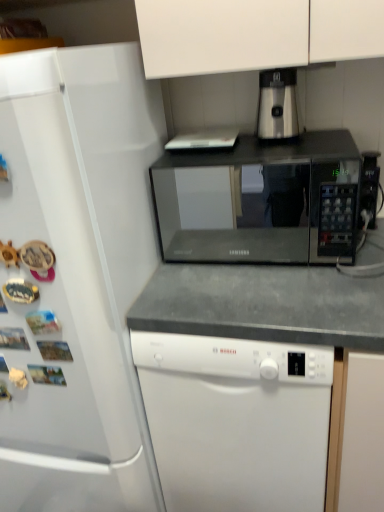
Question: From the image's perspective, is white matte dishwasher at center positioned above or below black matte microwave at center?

Choices:
 (A) below
 (B) above

Answer: (A)

Question: Is white matte dishwasher at center in front of or behind black matte microwave at center in the image?

Choices:
 (A) front
 (B) behind

Answer: (A)

Question: Which is farther from the white matte dishwasher at center?

Choices:
 (A) white glossy refrigerator at left
 (B) satin silver coffee machine at upper center
 (C) black matte microwave at center

Answer: (C)

Question: Which of these objects is positioned closest to the satin silver coffee machine at upper center?

Choices:
 (A) white matte dishwasher at center
 (B) white glossy refrigerator at left
 (C) black matte microwave at center

Answer: (B)